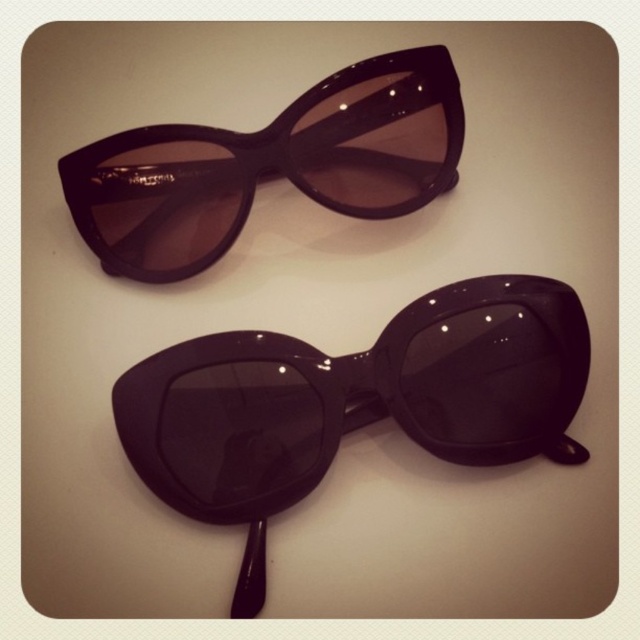
You are organizing sunglasses on a display table. You have two pairs of glossy black sunglasses at center and glossy black sunglasses at upper center. Which one is located to the right of the other?

The glossy black sunglasses at center is positioned on the right side of glossy black sunglasses at upper center.

You are looking at a table with two pairs of retro sunglasses. The point marked at coordinates (x=353, y=403) is where the glossy black sunglasses at center are located. If you were to place a small sticker exactly at that point, which pair of sunglasses would it be on?

The point at coordinates (x=353, y=403) corresponds to the glossy black sunglasses at center, so the sticker would be placed on the glossy black sunglasses at center.

You are standing at the origin of the coordinate system in the image. You see two points labeled as point (486, 305) and point (97, 198). Which point is closer to you?

Point (97, 198) is closer to you because it is in front of point (486, 305).